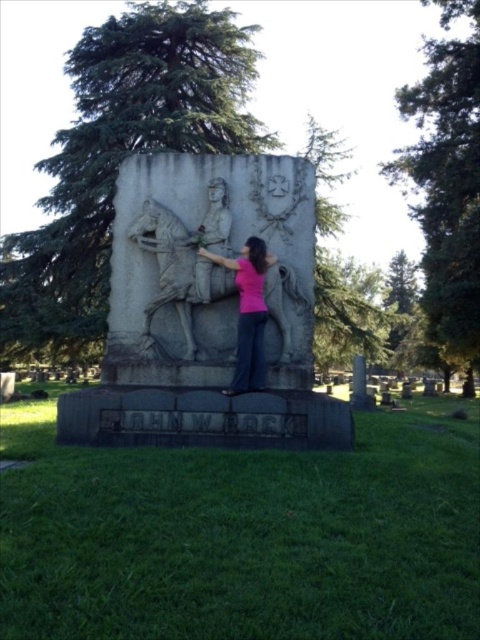
Between gray stone relief at center and pink fabric at center, which one has less height?

Standing shorter between the two is pink fabric at center.

Between gray stone relief at center and pink fabric at center, which one appears on the left side from the viewer's perspective?

gray stone relief at center is more to the left.

I want to click on gray stone relief at center, so click(207, 266).